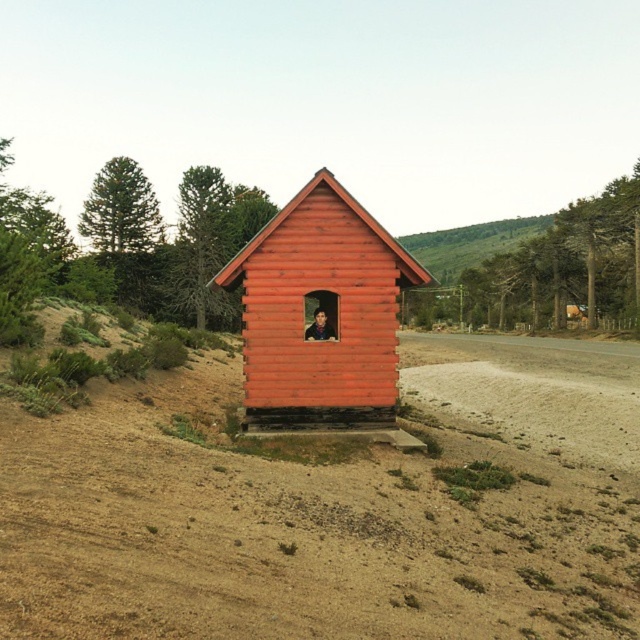
Question: Can you confirm if dull brown dirt at center is wider than smooth wooden cabin at center?

Choices:
 (A) yes
 (B) no

Answer: (A)

Question: Can you confirm if dull brown dirt at center is smaller than smooth wooden cabin at center?

Choices:
 (A) yes
 (B) no

Answer: (B)

Question: Among these objects, which one is nearest to the camera?

Choices:
 (A) dull brown dirt at center
 (B) smooth wooden cabin at center

Answer: (A)

Question: Does dull brown dirt at center have a greater width compared to smooth wooden cabin at center?

Choices:
 (A) no
 (B) yes

Answer: (B)

Question: Which of the following is the farthest from the observer?

Choices:
 (A) (570, 452)
 (B) (384, 426)

Answer: (A)